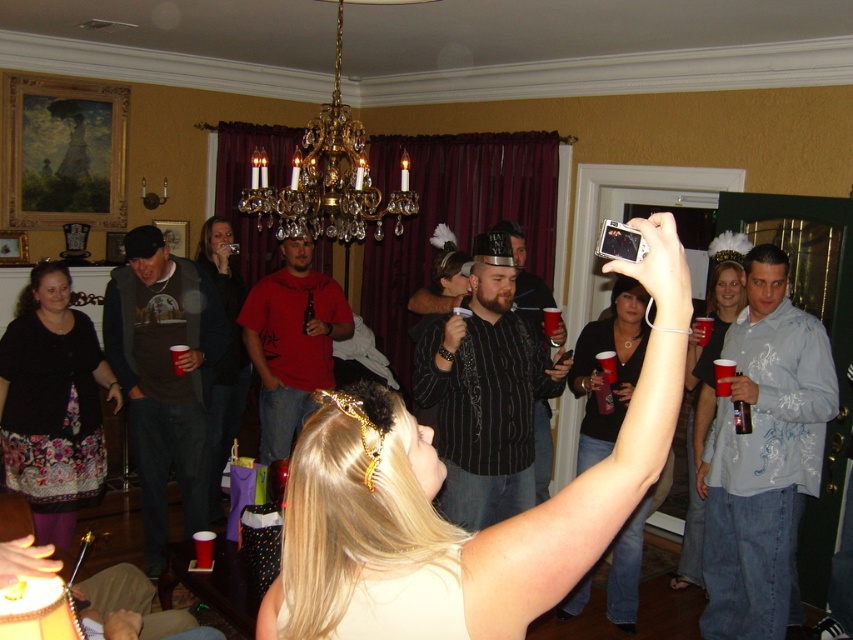
You are a photographer at the party and want to take a photo of both the black striped shirt at center and the black matte dress at upper center. However, you notice that one is blocking the other. Which one is in front and needs to be moved for a clear shot?

The black striped shirt at center is in front of the black matte dress at upper center, so you need to move the black striped shirt at center to capture both clearly.

You are a photographer at the party and want to take a photo of the black matte dress at center without the matte black camera at upper center appearing in the frame. Is this possible?

The matte black camera at upper center is positioned on the right side of the black matte dress at center, so if you move to the left side of the dress, you can avoid the camera in the frame.